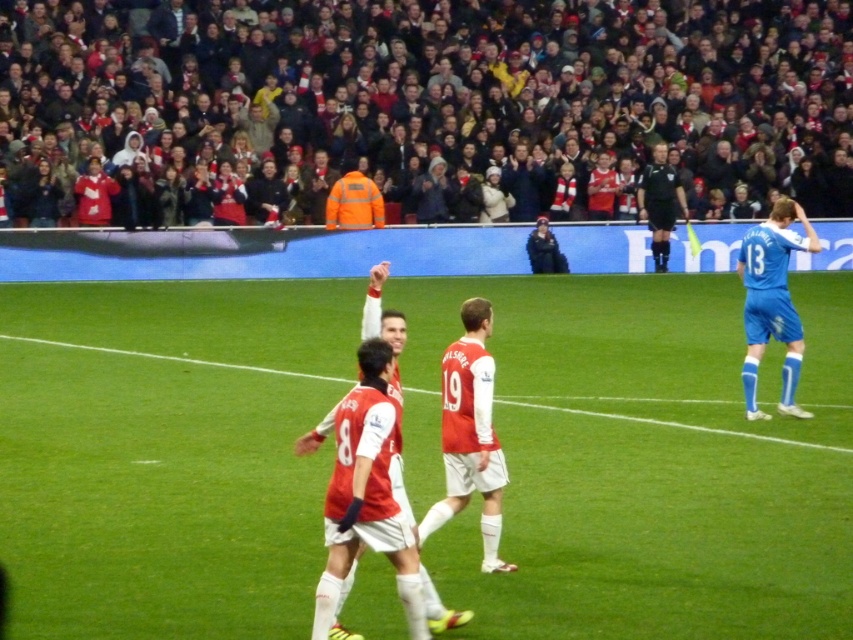
Question: Does black uniform at center appear under orange reflective jacket at upper center?

Choices:
 (A) yes
 (B) no

Answer: (A)

Question: Which of these objects is positioned farthest from the blue smooth jersey at right?

Choices:
 (A) orange reflective jacket at upper center
 (B) red matte jersey at center
 (C) dark blue jacket at upper center

Answer: (A)

Question: Which object appears farthest from the camera in this image?

Choices:
 (A) blue smooth jersey at right
 (B) green grass football field at center

Answer: (A)

Question: Among these objects, which one is farthest from the camera?

Choices:
 (A) green grass football field at center
 (B) black uniform at center
 (C) dark blue jacket at upper center
 (D) blue smooth jersey at right

Answer: (B)

Question: Is red matte jersey at center thinner than black uniform at center?

Choices:
 (A) yes
 (B) no

Answer: (A)

Question: Is green grass football field at center bigger than blue smooth jersey at right?

Choices:
 (A) yes
 (B) no

Answer: (A)